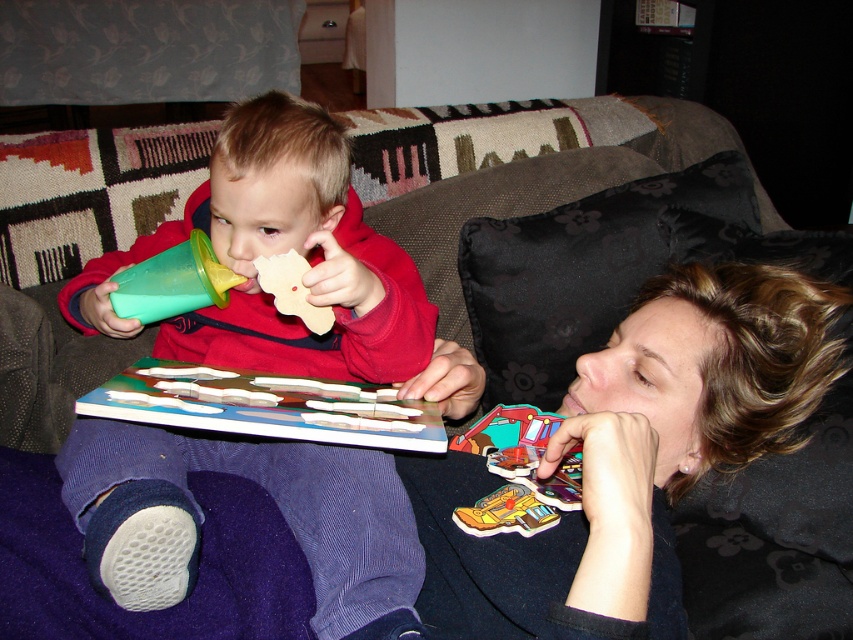
Between matte plastic cup at left and yellow matte puzzle piece at lower center, which one has more height?

With more height is matte plastic cup at left.

Is matte plastic cup at left positioned in front of yellow matte puzzle piece at lower center?

That is True.

Locate an element on the screen. The width and height of the screenshot is (853, 640). matte plastic cup at left is located at coordinates (280, 252).

Which is above, yellow matte puzzle piece at lower center or wooden puzzle piece at center?

wooden puzzle piece at center is above.

Can you confirm if yellow matte puzzle piece at lower center is thinner than wooden puzzle piece at center?

No, yellow matte puzzle piece at lower center is not thinner than wooden puzzle piece at center.

Who is more forward, (469, 436) or (258, 262)?

Point (258, 262)

The image size is (853, 640). I want to click on yellow matte puzzle piece at lower center, so click(x=518, y=472).

Which is behind, point (306, 488) or point (637, 444)?

Point (306, 488)

Is matte plastic cup at left to the left of matte black puzzle piece at upper right from the viewer's perspective?

Yes, matte plastic cup at left is to the left of matte black puzzle piece at upper right.

Does point (328, 584) come closer to viewer compared to point (747, 337)?

Yes.

I want to click on matte plastic cup at left, so click(280, 252).